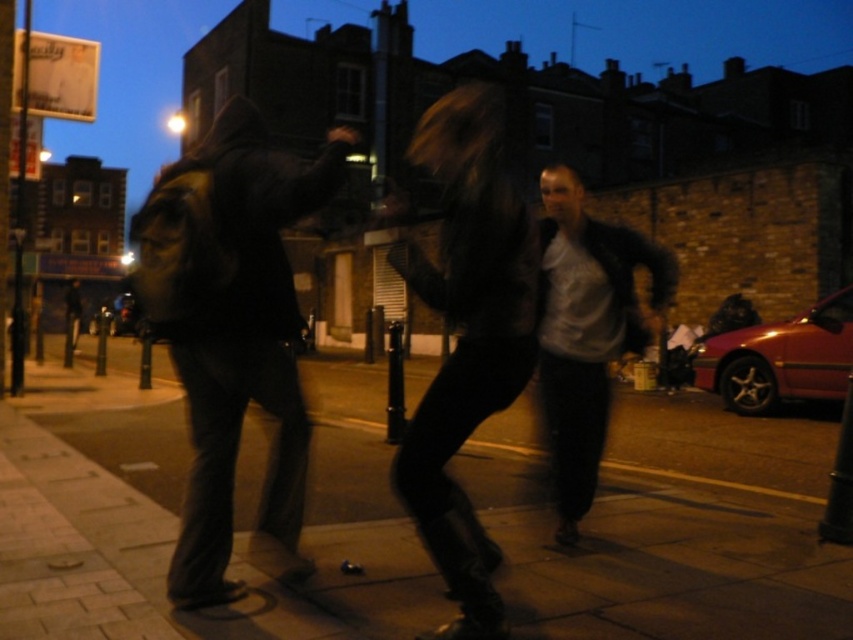
Is dark leather jacket at center thinner than shiny black hair at center?

In fact, dark leather jacket at center might be wider than shiny black hair at center.

I want to click on dark leather jacket at center, so click(468, 336).

Does point (265, 182) come in front of point (485, 634)?

No, it is behind (485, 634).

Is dark matte jacket at left shorter than dark leather jacket at center?

Indeed, dark matte jacket at left has a lesser height compared to dark leather jacket at center.

Between point (306, 436) and point (457, 397), which one is positioned in front?

Positioned in front is point (457, 397).

You are a GUI agent. You are given a task and a screenshot of the screen. Output one action in this format:
    pyautogui.click(x=<x>, y=<y>)
    Task: Click on the dark matte jacket at left
    The width and height of the screenshot is (853, 640).
    Given the screenshot: What is the action you would take?
    pyautogui.click(x=231, y=328)

From the picture: Who is positioned more to the right, dark matte jacket at left or shiny black hair at center?

From the viewer's perspective, shiny black hair at center appears more on the right side.

Identify the location of dark matte jacket at left. This screenshot has width=853, height=640. (231, 328).

The height and width of the screenshot is (640, 853). Find the location of `dark matte jacket at left`. dark matte jacket at left is located at coordinates (231, 328).